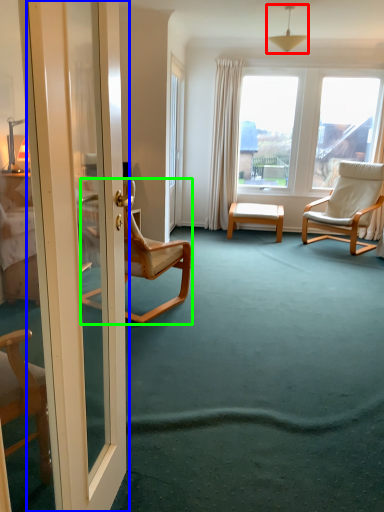
Question: Estimate the real-world distances between objects in this image. Which object is closer to lamp (highlighted by a red box), door (highlighted by a blue box) or chair (highlighted by a green box)?

Choices:
 (A) door
 (B) chair

Answer: (B)